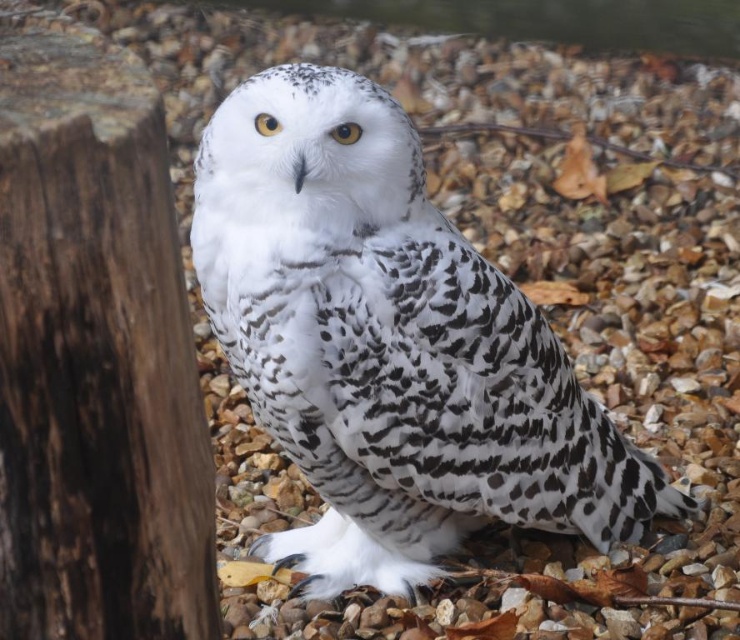
You are an ornithologist observing the white speckled owl at center and the dark brown rough wood at left. Which object is closer to your viewpoint?

The white speckled owl at center is closer to the viewer than the dark brown rough wood at left.

You are a photographer trying to capture the white speckled owl at center and the dark brown rough wood at left. Based on their positions, which object is closer to the right edge of the image?

The white speckled owl at center is positioned on the right side of dark brown rough wood at left, so the white speckled owl at center is closer to the right edge of the image.

Looking at this image, you are a birdwatcher trying to identify the height of the white speckled owl at center compared to the dark brown rough wood at left. Based on the scene, which one is taller?

The white speckled owl at center is taller than the dark brown rough wood at left according to the description.